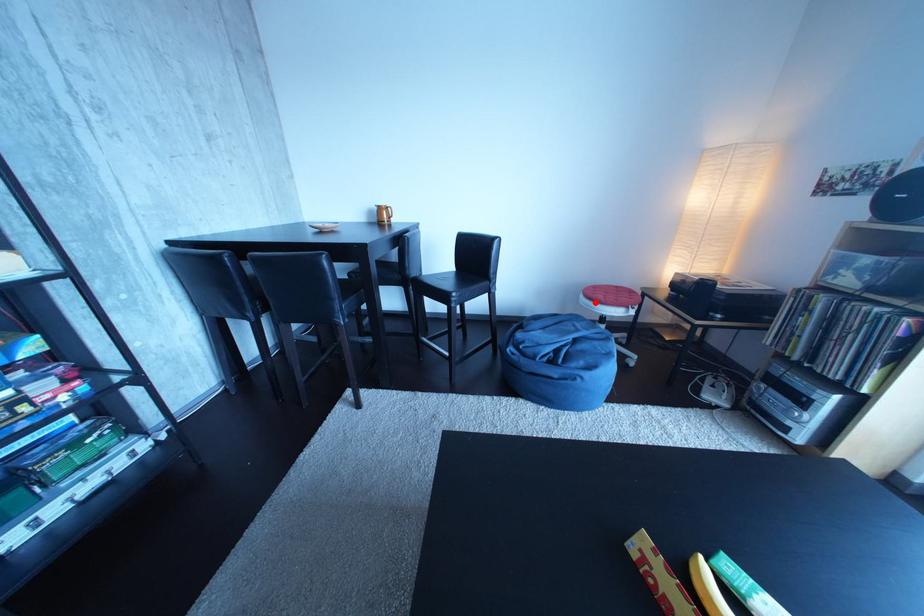
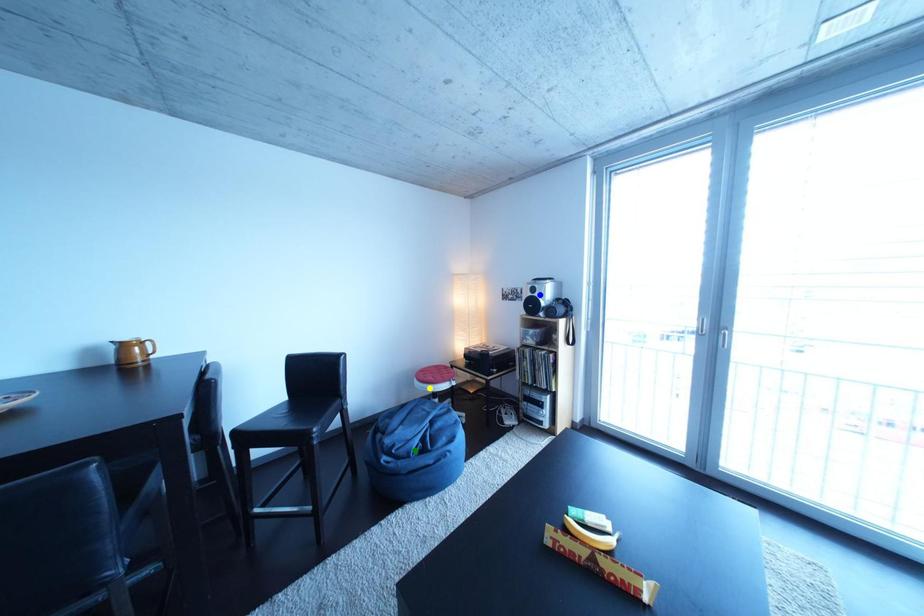
Question: I am providing you with two images of the same scene from different viewpoints. A red point is marked on the first image. You are given multiple points on the second image. Which point in image 2 represents the same 3d spot as the red point in image 1?

Choices:
 (A) blue point
 (B) green point
 (C) yellow point

Answer: (C)